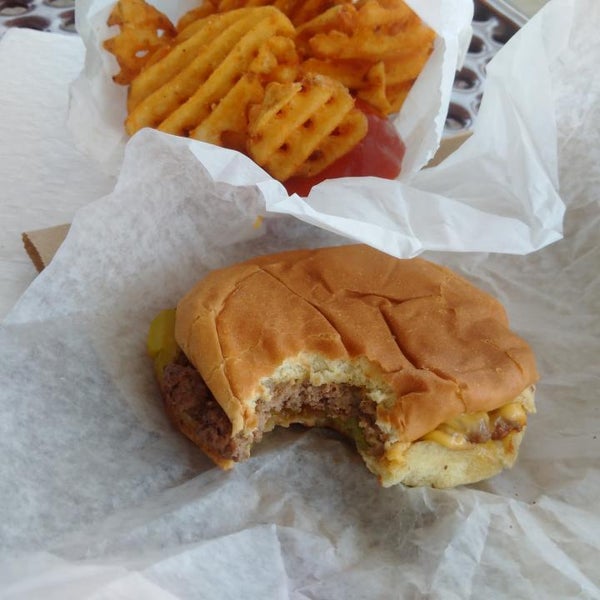
In order to click on tray in this screenshot , I will do `click(460, 103)`.